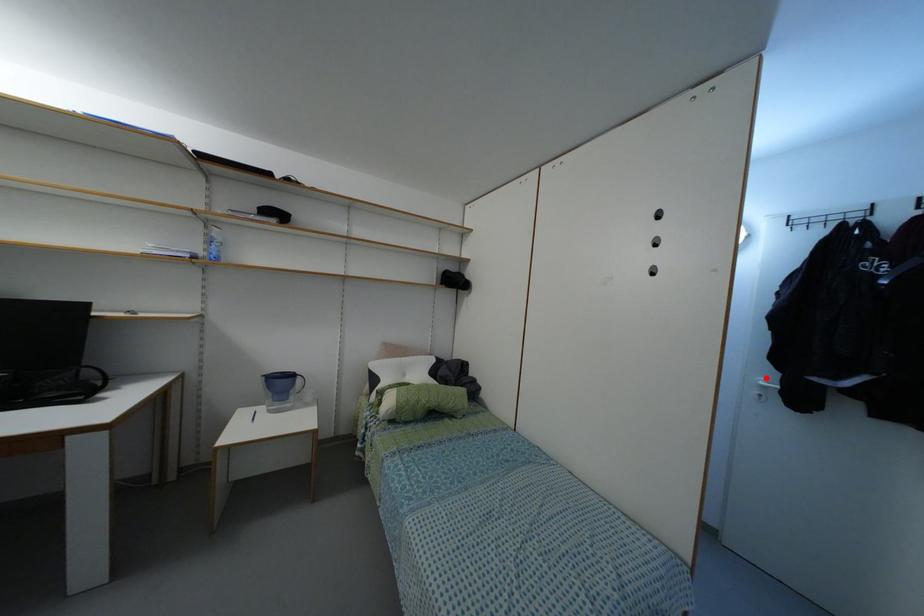
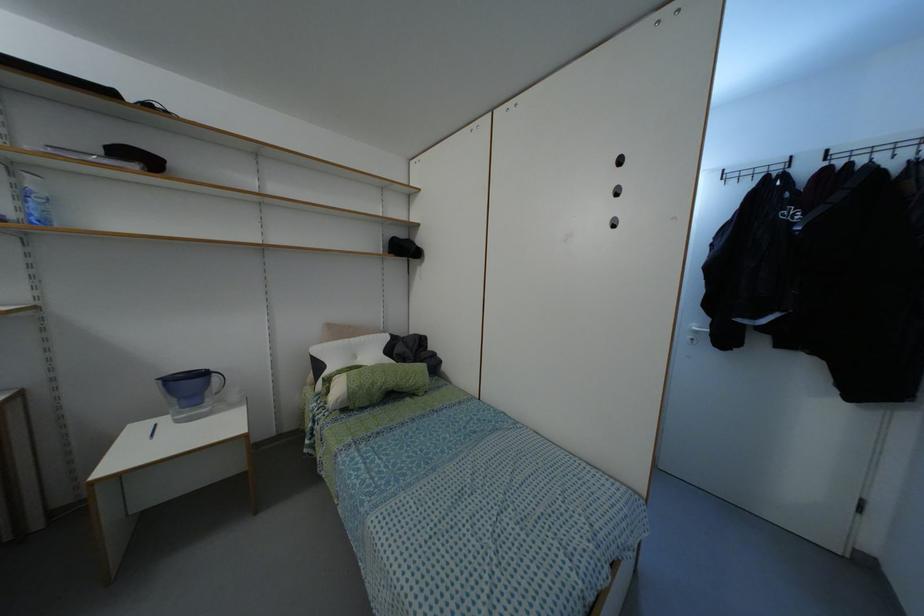
Question: I am providing you with two images of the same scene from different viewpoints. A red point is marked on the first image. Can you still see the location of the red point in image 2?

Choices:
 (A) Yes
 (B) No

Answer: (A)